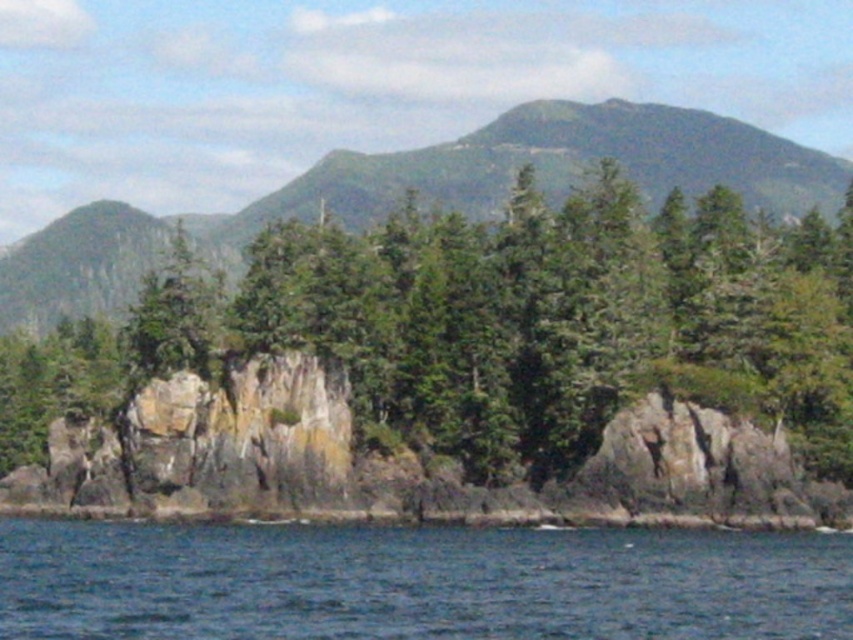
You are standing at the rocky shoreline and want to reach both the point at coordinates (703, 372) and the point at (799, 196). Which point will you reach first if you walk straight ahead?

You will reach point (703, 372) first because it is closer to you than point (799, 196).

You are a hiker planning to cross the rocky shoreline. You see the green rough rock at center and the green textured mountain at upper center. Which object is closer to you?

The green rough rock at center is closer to you than the green textured mountain at upper center because it is positioned in the foreground of the image.

You are a hiker planning to cross from the green rough rock at center to the green textured mountain at upper center. Given that your backpack can only carry enough supplies for a 100 meter journey, will you have enough supplies to make the trip?

The green rough rock at center and green textured mountain at upper center are 105.63 meters apart. Since the distance exceeds the 100 meter capacity of your supplies, you will not have enough to make the trip.